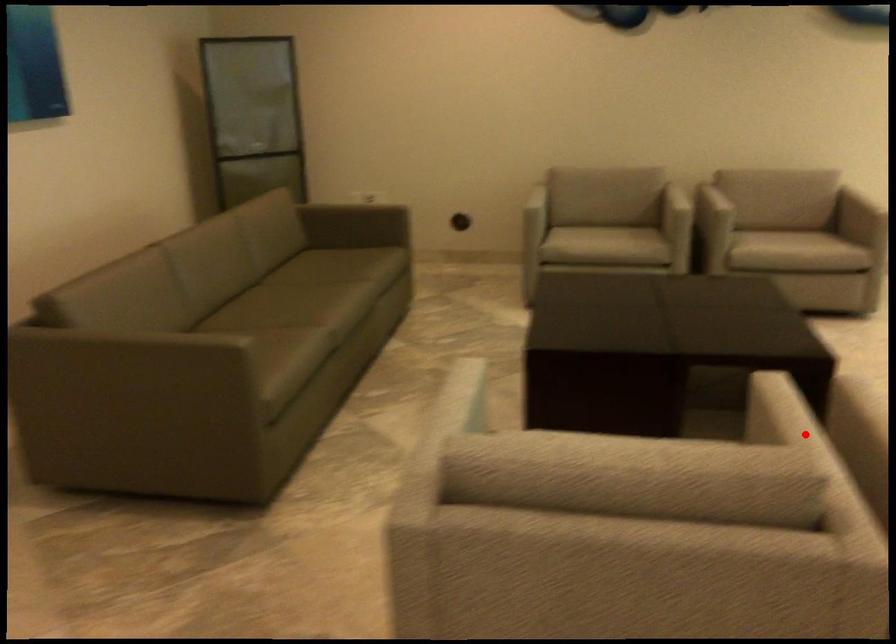
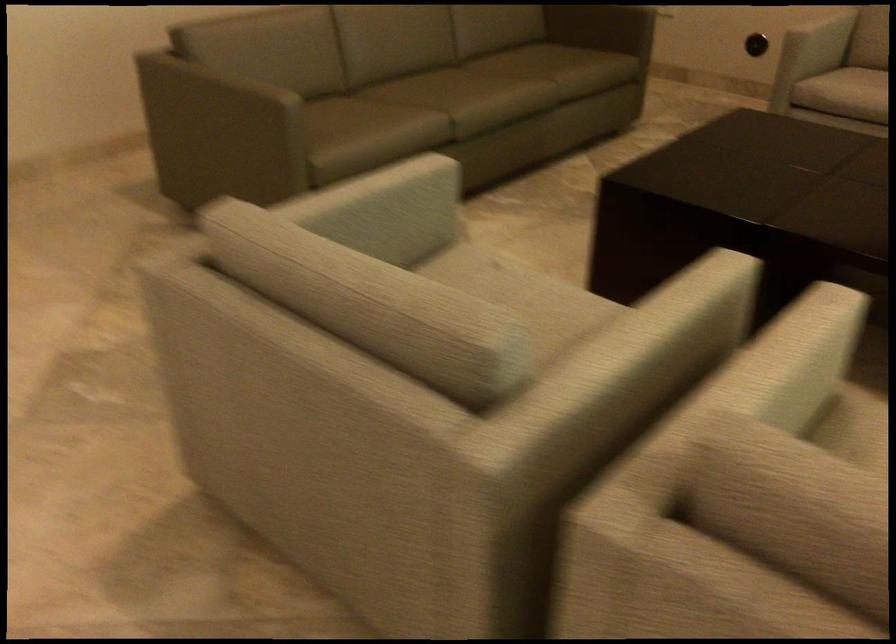
Question: I am providing you with two images of the same scene from different viewpoints. Image1 has a red point marked. In image2, the corresponding 3D location appears at what relative position? Reply with the corresponding letter.

Choices:
 (A) Closer
 (B) Farther

Answer: (A)